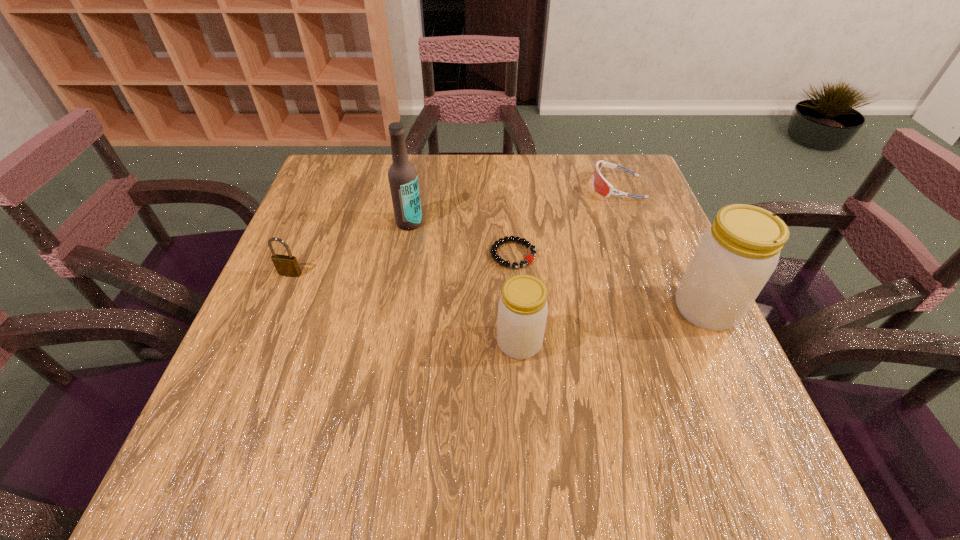
Where is `vacant place for an extra jar on the left`? vacant place for an extra jar on the left is located at coordinates (305, 382).